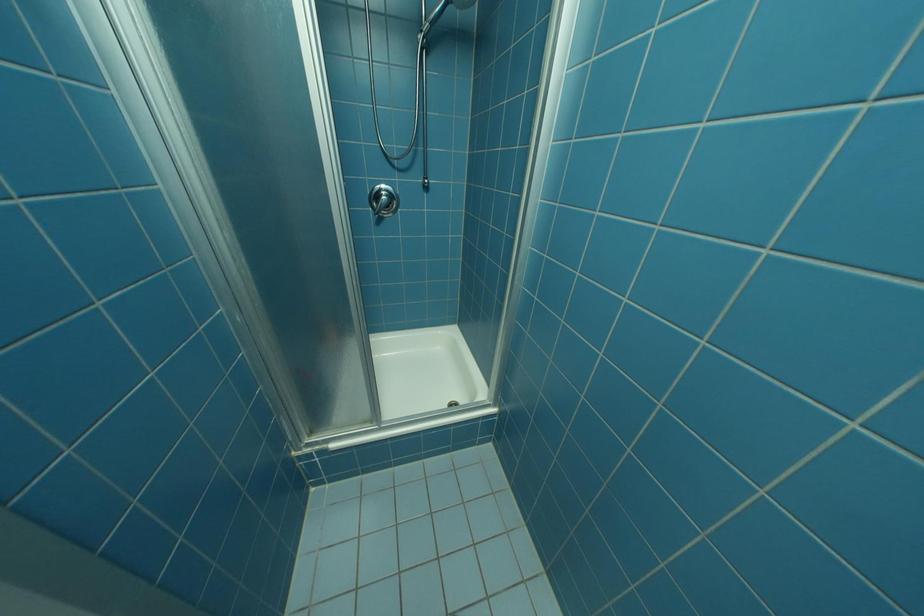
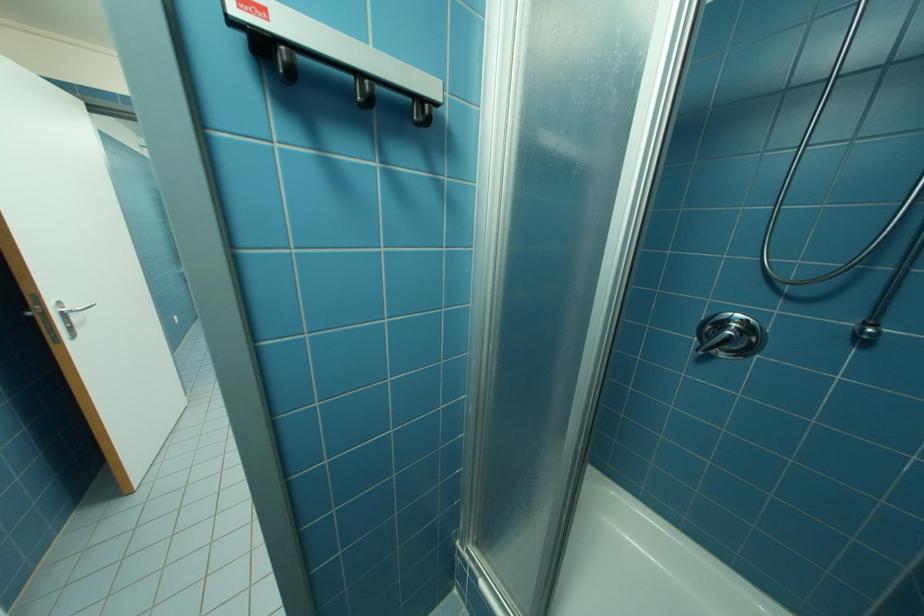
Question: The first image is from the beginning of the video and the second image is from the end. How did the camera likely rotate when shooting the video?

Choices:
 (A) Left
 (B) Right
 (C) Up
 (D) Down

Answer: (A)